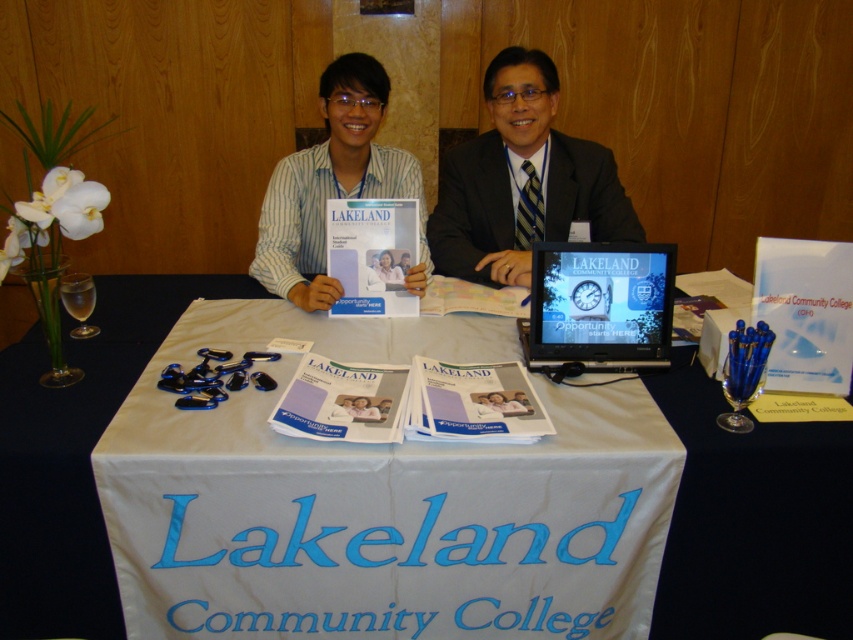
The width and height of the screenshot is (853, 640). Describe the element at coordinates (521, 180) in the screenshot. I see `matte black suit at center` at that location.

Who is more forward, (584, 170) or (550, 285)?

Point (550, 285) is in front.

The image size is (853, 640). Find the location of `matte black suit at center`. matte black suit at center is located at coordinates (521, 180).

Is matte black suit at center positioned in front of white striped shirt at center?

No, matte black suit at center is behind white striped shirt at center.

What do you see at coordinates (521, 180) in the screenshot?
I see `matte black suit at center` at bounding box center [521, 180].

Between point (445, 164) and point (279, 172), which one is positioned behind?

The point (445, 164) is behind.

You are a GUI agent. You are given a task and a screenshot of the screen. Output one action in this format:
    pyautogui.click(x=<x>, y=<y>)
    Task: Click on the matte black suit at center
    Image resolution: width=853 pixels, height=640 pixels.
    Given the screenshot: What is the action you would take?
    coord(521,180)

Is point (590, 552) closer to viewer compared to point (461, 266)?

Yes, point (590, 552) is in front of point (461, 266).

Is white fabric at center smaller than white paper at center?

Actually, white fabric at center might be larger than white paper at center.

Where is `white fabric at center`? This screenshot has width=853, height=640. white fabric at center is located at coordinates (379, 500).